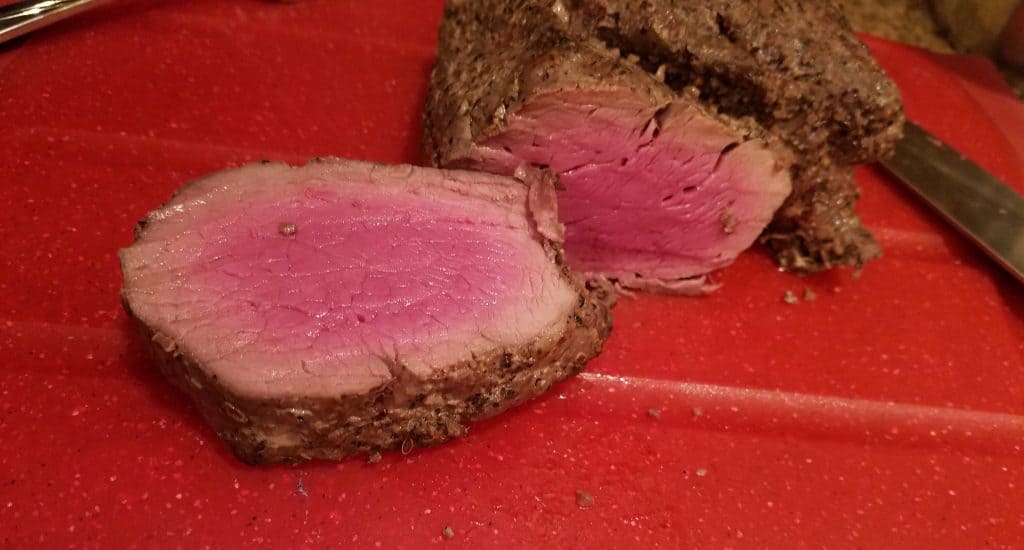
The height and width of the screenshot is (550, 1024). What are the coordinates of `crumb` in the screenshot? It's located at (584, 511), (653, 414), (319, 496), (803, 302).